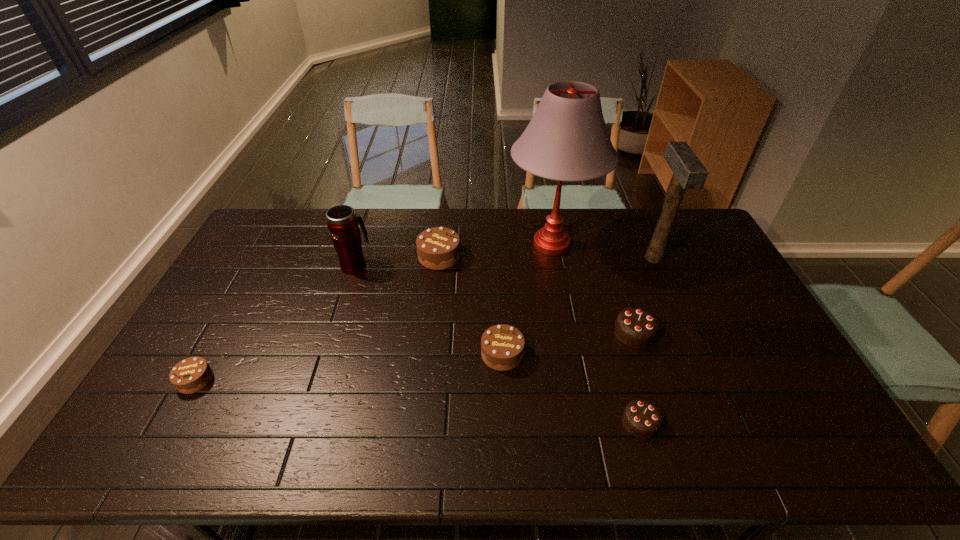
Find the location of a particular element. This screenshot has width=960, height=540. light table lamp is located at coordinates (567, 140).

Locate an element on the screen. the tallest object is located at coordinates (567, 140).

Identify the location of mallet. The width and height of the screenshot is (960, 540). (688, 172).

In order to click on the seventh shortest object in this screenshot , I will do `click(688, 172)`.

Image resolution: width=960 pixels, height=540 pixels. What are the coordinates of `the third tallest object` in the screenshot? It's located at (342, 223).

Find the location of a particular element. the second object from left to right is located at coordinates (342, 223).

The height and width of the screenshot is (540, 960). Find the location of `the second chocolate cake from left to right`. the second chocolate cake from left to right is located at coordinates (438, 248).

Locate an element on the screen. the farthest chocolate cake is located at coordinates (438, 248).

What are the coordinates of `the third chocolate cake from right to left` in the screenshot? It's located at (502, 346).

Image resolution: width=960 pixels, height=540 pixels. I want to click on the rightmost brown chocolate cake, so click(502, 346).